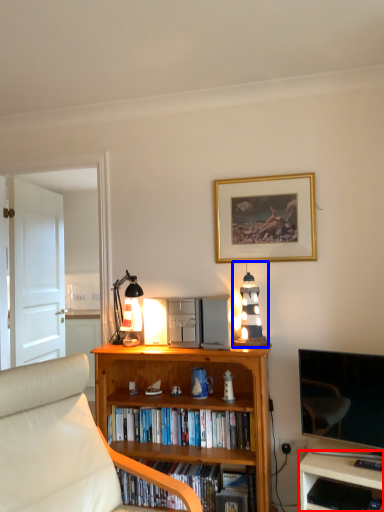
Question: Which object is further to the camera taking this photo, desk (highlighted by a red box) or lamp (highlighted by a blue box)?

Choices:
 (A) desk
 (B) lamp

Answer: (B)